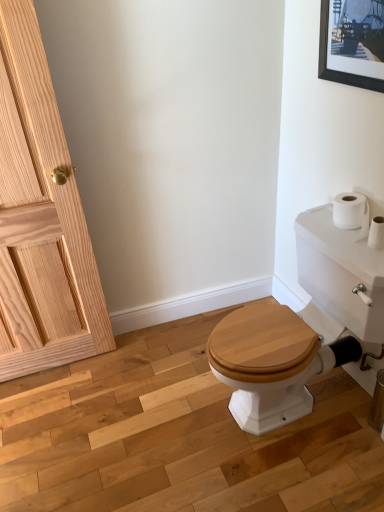
Locate an element on the screen. The width and height of the screenshot is (384, 512). unoccupied area in front of white glossy porcelain at right is located at coordinates (304, 478).